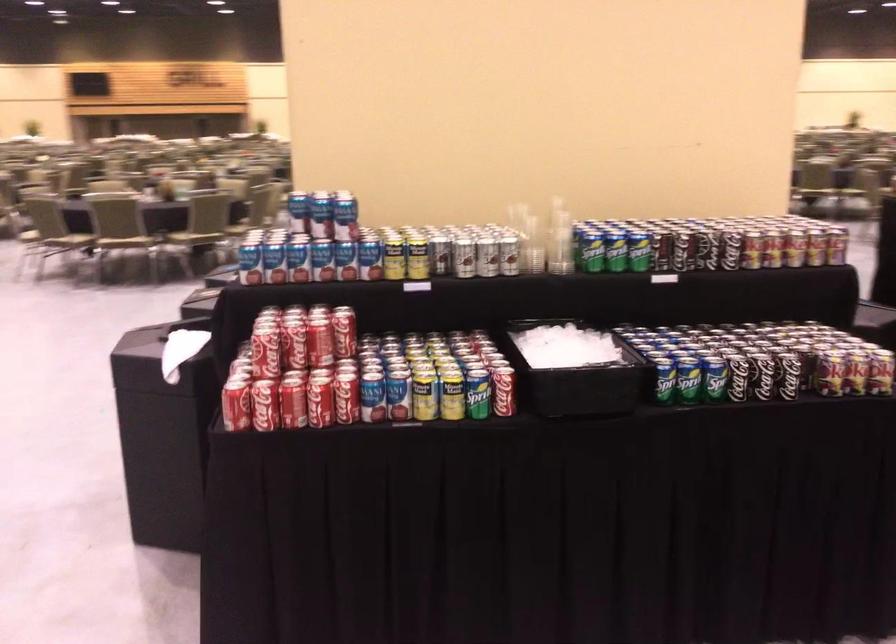
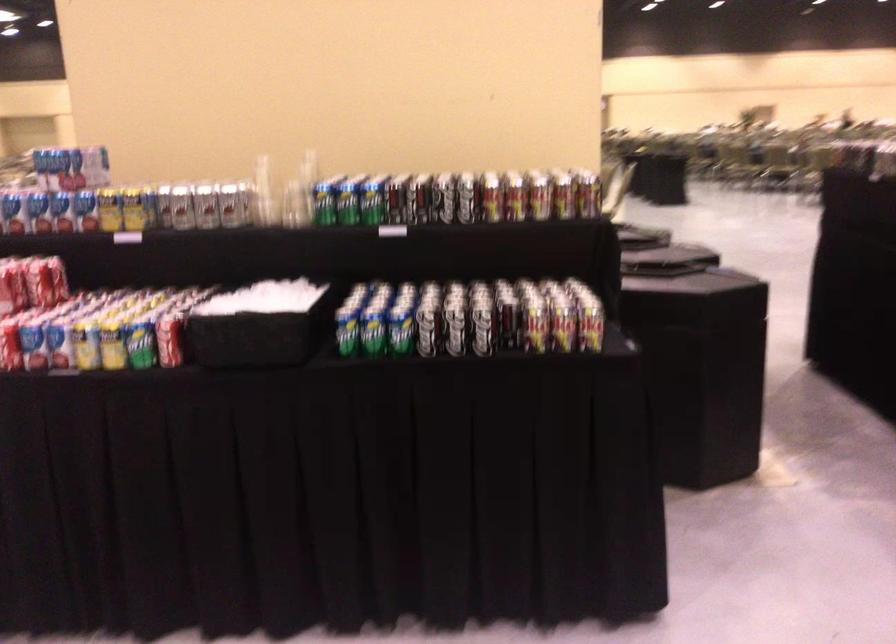
Find the pixel in the second image that matches point (416, 400) in the first image.

(84, 345)